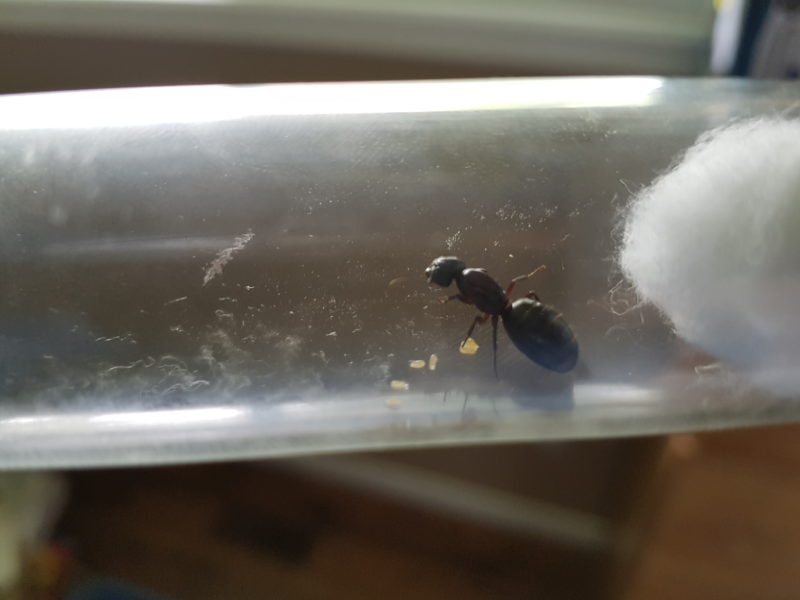
You are a GUI agent. You are given a task and a screenshot of the screen. Output one action in this format:
    pyautogui.click(x=<x>, y=<y>)
    Task: Click on the floor
    The height and width of the screenshot is (600, 800).
    Given the screenshot: What is the action you would take?
    pyautogui.click(x=390, y=577)